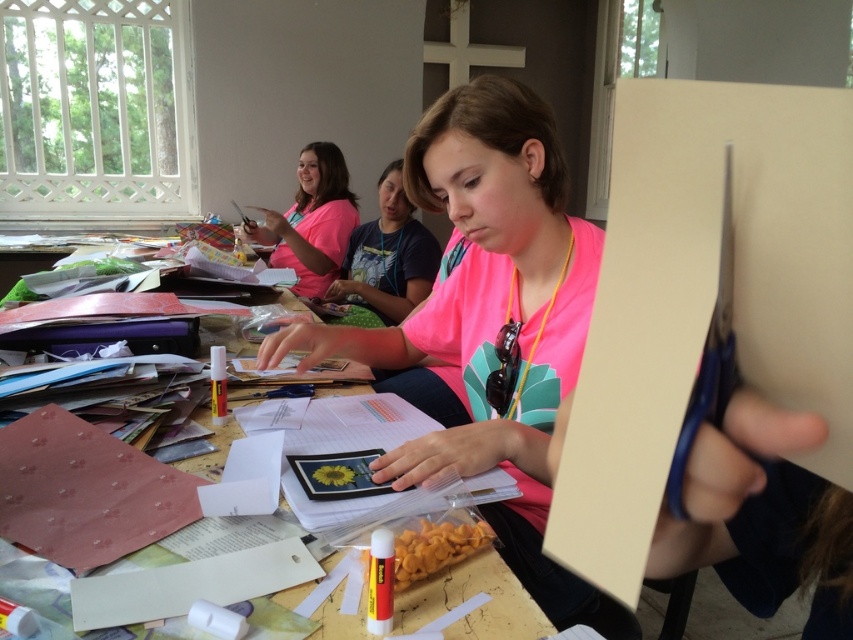
Is pink matte shirt at center thinner than matte pink shirt at upper left?

Yes, pink matte shirt at center is thinner than matte pink shirt at upper left.

Can you confirm if pink matte shirt at center is wider than matte pink shirt at upper left?

In fact, pink matte shirt at center might be narrower than matte pink shirt at upper left.

Does point (407, 236) come farther from viewer compared to point (305, 284)?

No, it is in front of (305, 284).

Where is `pink matte shirt at center`? The image size is (853, 640). pink matte shirt at center is located at coordinates (387, 257).

Does wooden table at center appear over matte pink shirt at upper left?

No.

Is wooden table at center smaller than matte pink shirt at upper left?

Yes, wooden table at center is smaller than matte pink shirt at upper left.

Locate an element on the screen. This screenshot has width=853, height=640. wooden table at center is located at coordinates coord(469,595).

Find the location of a particular element. The width and height of the screenshot is (853, 640). wooden table at center is located at coordinates (469, 595).

Is point (335, 378) positioned behind point (403, 304)?

No.

Where is `wooden table at center`? wooden table at center is located at coordinates (469, 595).